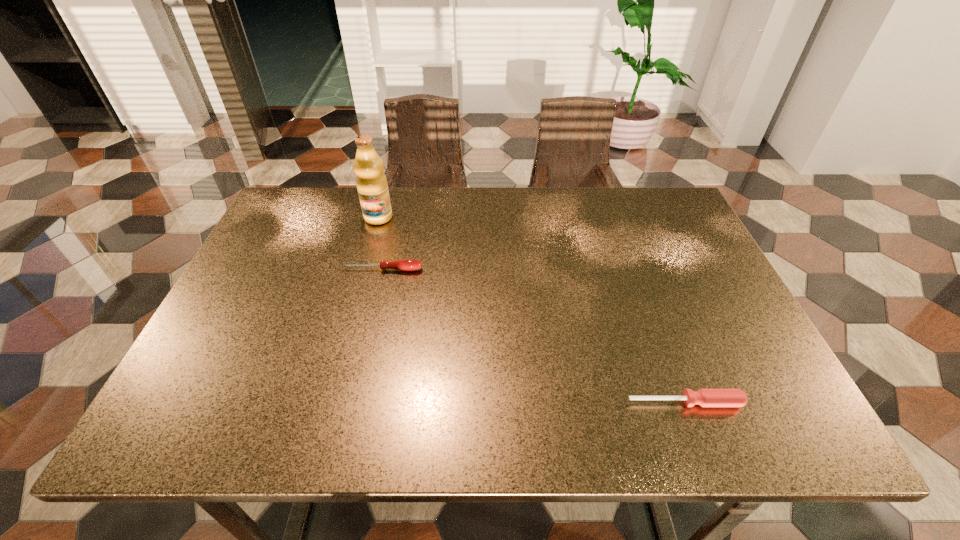
Where is `free spot between the rightmost object and the left screwdriver`? free spot between the rightmost object and the left screwdriver is located at coordinates (534, 336).

Find the location of `free point between the fruit juice and the nearest object`. free point between the fruit juice and the nearest object is located at coordinates (532, 310).

Where is `free space between the farthest object and the rightmost object`? Image resolution: width=960 pixels, height=540 pixels. free space between the farthest object and the rightmost object is located at coordinates (532, 310).

The width and height of the screenshot is (960, 540). I want to click on free point between the farthest object and the nearest object, so click(532, 310).

Identify the location of free space between the second nearest object and the farthest object. click(380, 244).

You are a GUI agent. You are given a task and a screenshot of the screen. Output one action in this format:
    pyautogui.click(x=<x>, y=<y>)
    Task: Click on the vacant space in between the tallest object and the farther screwdriver
    This screenshot has height=540, width=960.
    Given the screenshot: What is the action you would take?
    pyautogui.click(x=380, y=244)

Locate an element on the screen. free spot between the rightmost object and the fruit juice is located at coordinates (532, 310).

Where is `empty space between the tallest object and the right screwdriver`? This screenshot has height=540, width=960. empty space between the tallest object and the right screwdriver is located at coordinates (532, 310).

Point out which object is positioned as the nearest to the left screwdriver. Please provide its 2D coordinates. Your answer should be formatted as a tuple, i.e. [(x, y)], where the tuple contains the x and y coordinates of a point satisfying the conditions above.

[(371, 182)]

Identify which object is located as the second nearest to the farther screwdriver. Please provide its 2D coordinates. Your answer should be formatted as a tuple, i.e. [(x, y)], where the tuple contains the x and y coordinates of a point satisfying the conditions above.

[(704, 397)]